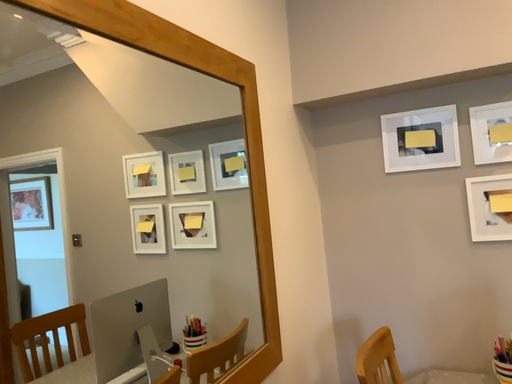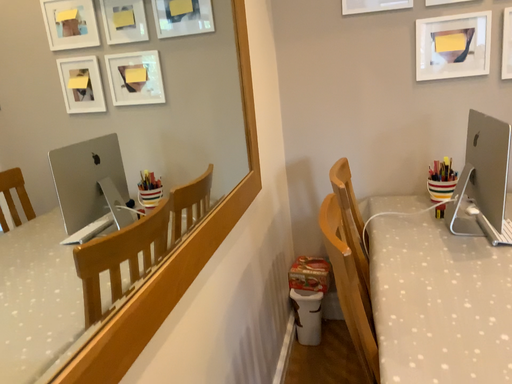
Question: Which way did the camera rotate in the video?

Choices:
 (A) rotated downward
 (B) rotated upward

Answer: (A)